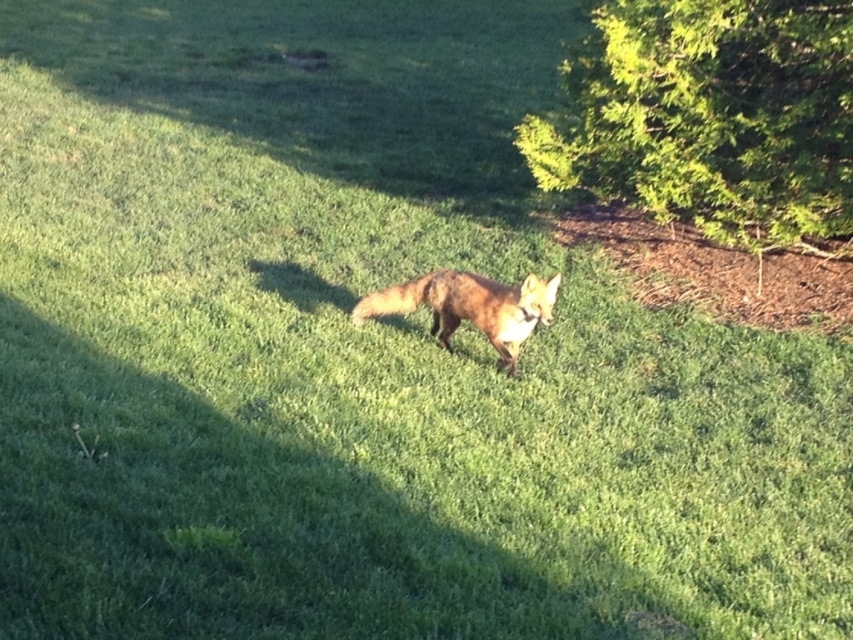
Question: Which point appears closest to the camera in this image?

Choices:
 (A) (621, 163)
 (B) (438, 342)

Answer: (B)

Question: Among these objects, which one is farthest from the camera?

Choices:
 (A) shiny reddish-brown fur at center
 (B) green leafy bush at upper right

Answer: (B)

Question: Does green leafy bush at upper right have a larger size compared to shiny reddish-brown fur at center?

Choices:
 (A) no
 (B) yes

Answer: (B)

Question: Which point is farther to the camera?

Choices:
 (A) green leafy bush at upper right
 (B) shiny reddish-brown fur at center

Answer: (A)

Question: Does green leafy bush at upper right have a smaller size compared to shiny reddish-brown fur at center?

Choices:
 (A) no
 (B) yes

Answer: (A)

Question: Can you confirm if green leafy bush at upper right is smaller than shiny reddish-brown fur at center?

Choices:
 (A) no
 (B) yes

Answer: (A)